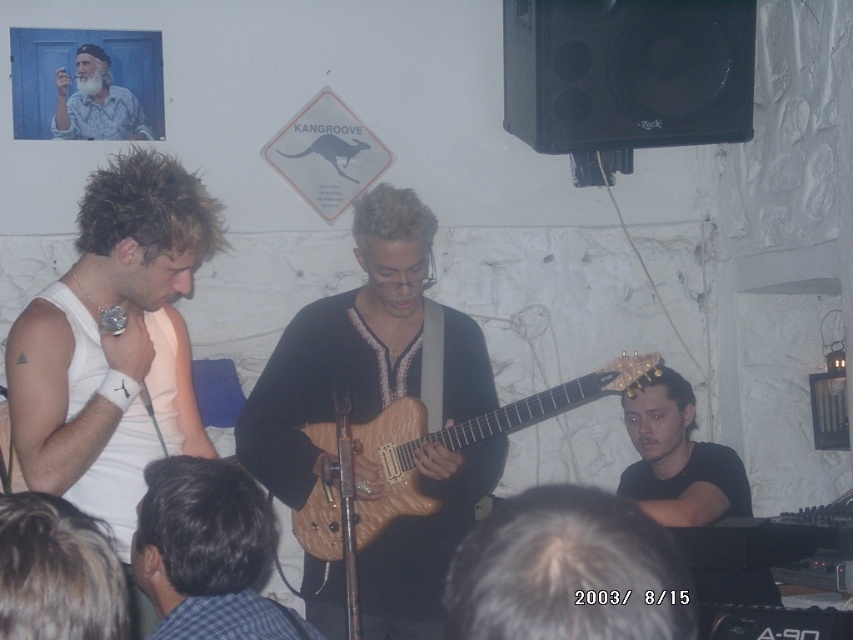
Who is positioned more to the right, natural wood electric guitar at center or black matte shirt at lower right?

black matte shirt at lower right

Can you confirm if natural wood electric guitar at center is bigger than black matte shirt at lower right?

Yes, natural wood electric guitar at center is bigger than black matte shirt at lower right.

Does point (494, 433) come in front of point (665, 497)?

Yes, it is in front of point (665, 497).

Image resolution: width=853 pixels, height=640 pixels. I want to click on natural wood electric guitar at center, so click(422, 448).

Is white matte tank top at left below gray hair at lower center?

No.

Is point (100, 221) farther from camera compared to point (610, 506)?

No.

Locate an element on the screen. white matte tank top at left is located at coordinates (114, 340).

Is point (532, 604) positioned before point (659, 500)?

Yes, point (532, 604) is closer to viewer.

Between point (608, 518) and point (633, 410), which one is positioned behind?

The point (633, 410) is more distant.

Locate an element on the screen. The width and height of the screenshot is (853, 640). gray hair at lower center is located at coordinates (567, 572).